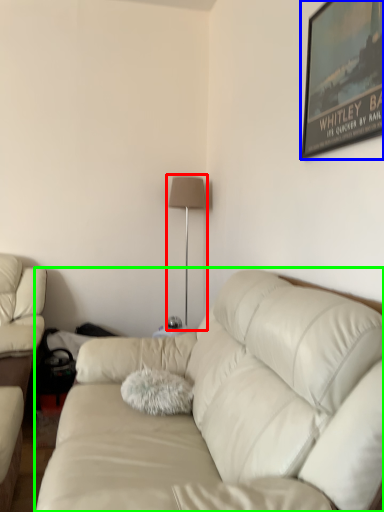
Question: Which object is positioned closest to table lamp (highlighted by a red box)? Select from picture frame (highlighted by a blue box) and studio couch (highlighted by a green box).

Choices:
 (A) picture frame
 (B) studio couch

Answer: (A)